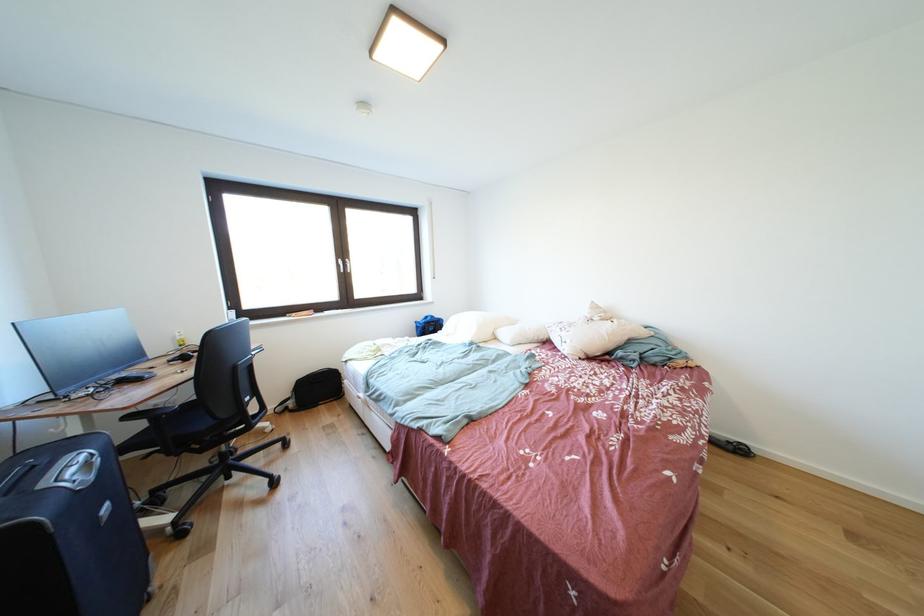
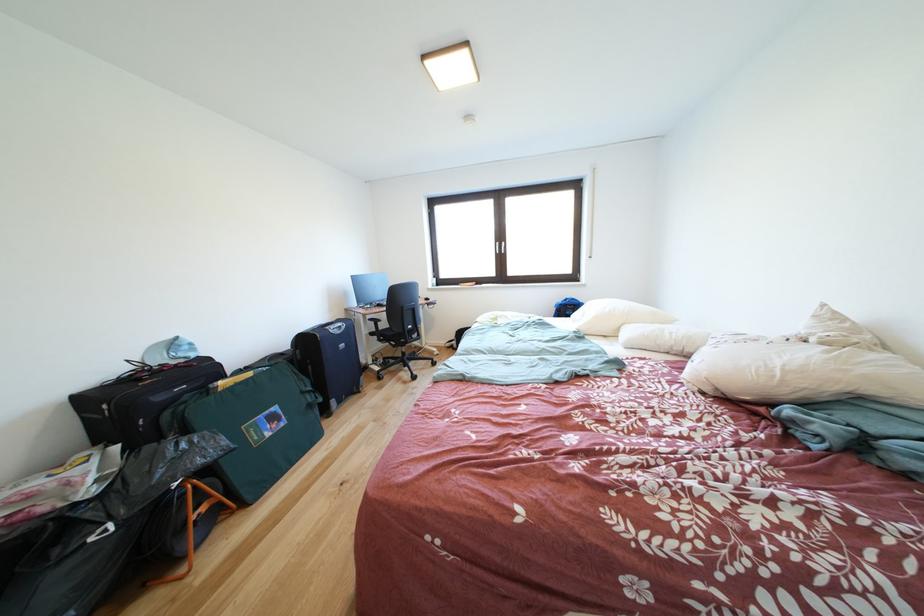
In the second image, find the point that corresponds to point 348,265 in the first image.

(505, 249)